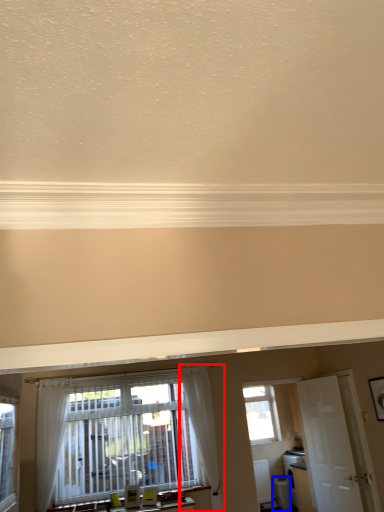
Question: Among these objects, which one is nearest to the camera, curtain (highlighted by a red box) or appliance (highlighted by a blue box)?

Choices:
 (A) curtain
 (B) appliance

Answer: (A)